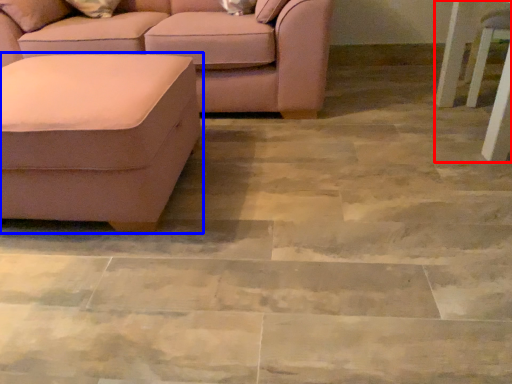
Question: Which object appears farthest to the camera in this image, side table (highlighted by a red box) or studio couch (highlighted by a blue box)?

Choices:
 (A) side table
 (B) studio couch

Answer: (A)